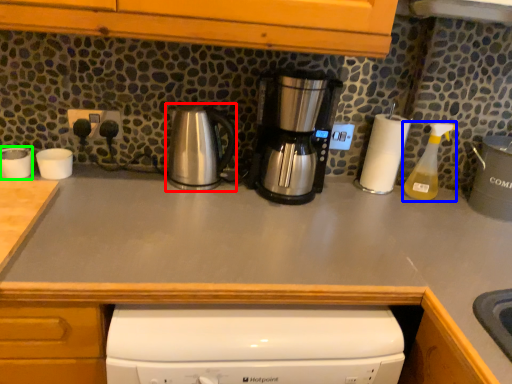
Question: Which object is the farthest from kitchen appliance (highlighted by a red box)? Choose among these: bottle (highlighted by a blue box) or appliance (highlighted by a green box).

Choices:
 (A) bottle
 (B) appliance

Answer: (A)